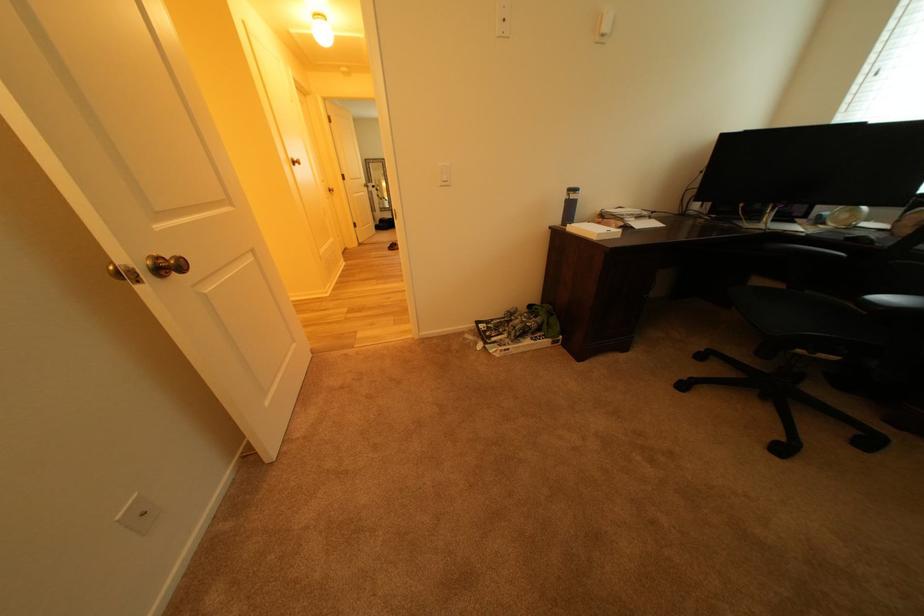
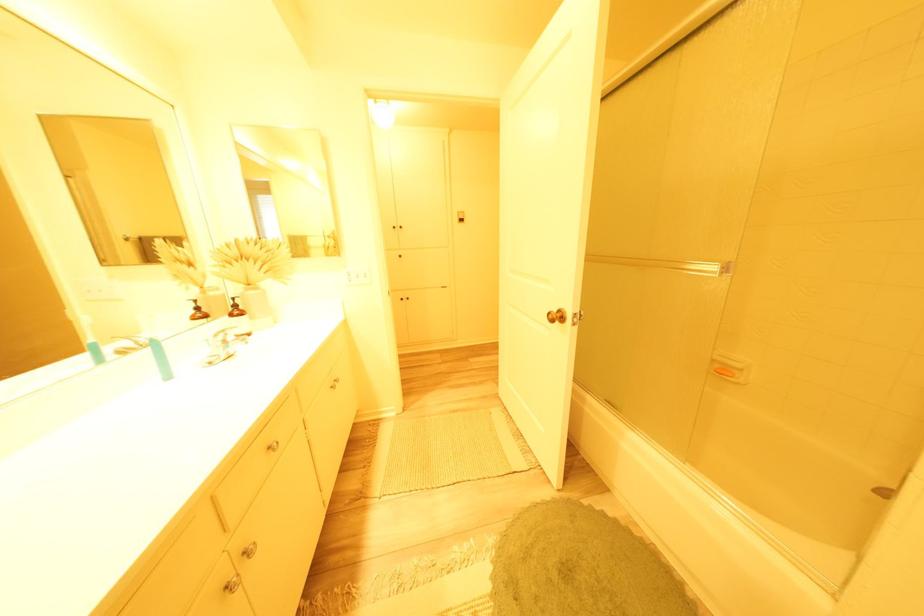
Question: In a continuous first-person perspective shot, in which direction is the camera moving?

Choices:
 (A) Left
 (B) Right
 (C) Forward
 (D) Backward

Answer: (A)